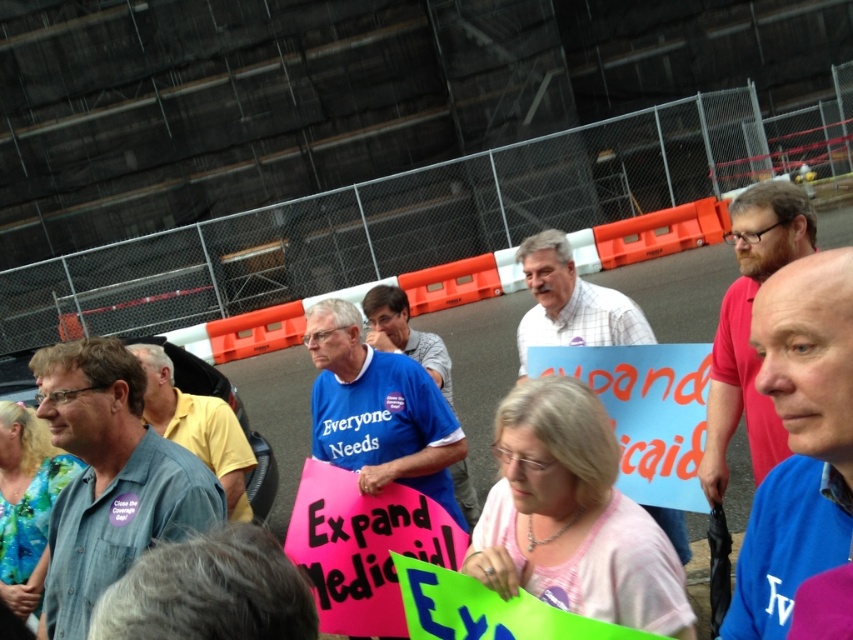
You are a photographer at the demonstration. You want to capture a photo that includes both the blue fabric shirt at center and the yellow shirt at center. Which shirt should you focus on first to ensure both are in frame?

The blue fabric shirt at center is in front of the yellow shirt at center, so focus on the blue fabric shirt at center first to ensure both are visible in the photo.

You are a photographer standing at the edge of the rally. You want to take a photo of the blue fabric shirt at center. Where should you aim your camera to capture it?

The blue fabric shirt at center is located at point coordinates 0.691 on the x axis and 0.938 on the y axis, so you should aim your camera at those coordinates to capture it.

You are a photographer standing at the edge of the crowd. You want to take a photo that includes both the blue fabric shirt at center and the blue denim shirt at center. If your camera has a minimum focus distance of 1.5 meters, will you be able to capture both shirts in the same frame without moving closer?

The blue fabric shirt at center and blue denim shirt at center are 1.74 meters apart from each other. Since the distance between them is greater than the camera minimum focus distance of 1.5 meters, you can capture both shirts in the same frame without moving closer.